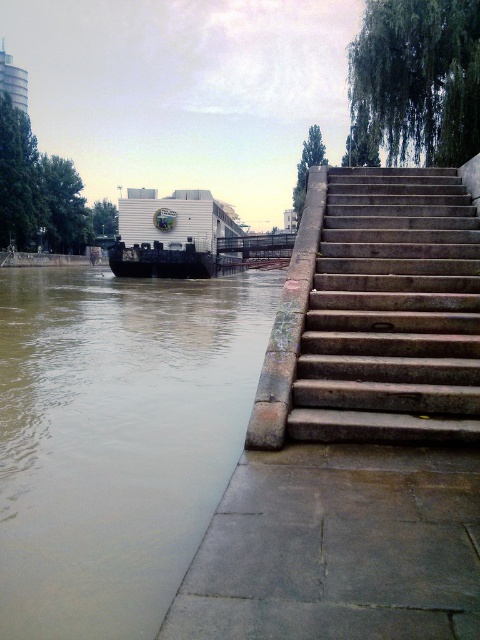
You are standing at the riverside and want to take a photo of the point at coordinates point (189, 477). If your camera has a maximum focus range of 15 feet, will you be able to focus on that point?

The distance of point (189, 477) from camera is 15.63 feet, which exceeds the camera maximum focus range of 15 feet. So you cannot focus on that point.